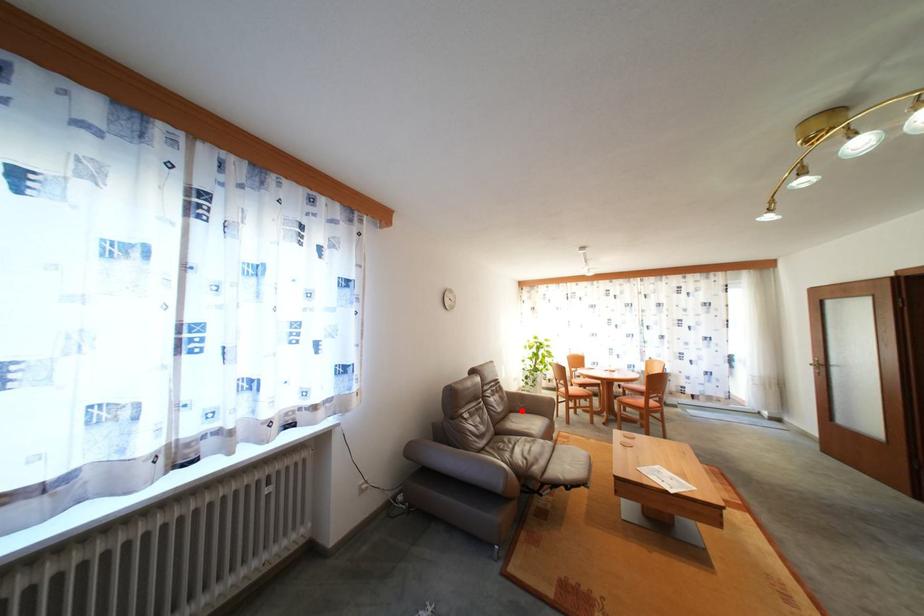
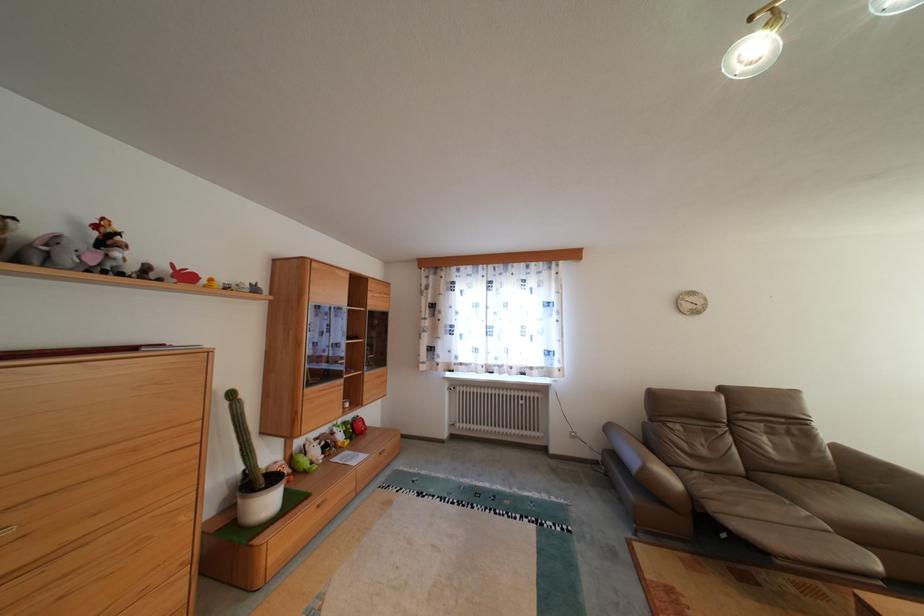
In the second image, find the point that corresponds to the highlighted location in the first image.

(854, 483)